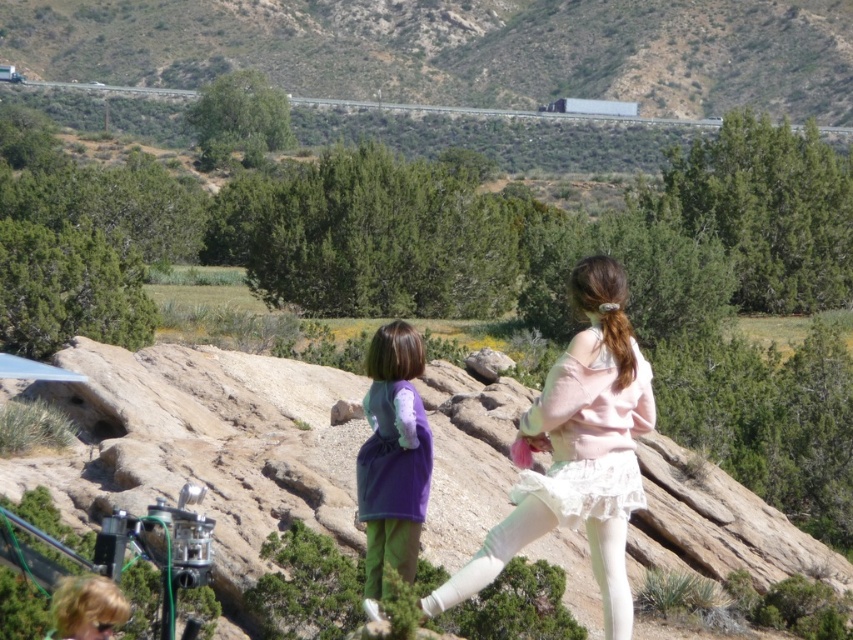
At what (x,y) coordinates should I click in order to perform the action: click on pastel pink fabric skirt at center. Please return your answer as a coordinate pair (x, y). Looking at the image, I should click on (577, 452).

Describe the element at coordinates (577, 452) in the screenshot. Image resolution: width=853 pixels, height=640 pixels. I see `pastel pink fabric skirt at center` at that location.

Image resolution: width=853 pixels, height=640 pixels. Identify the location of pastel pink fabric skirt at center. (577, 452).

Is green grassy hillside at upper center to the left of purple fleece dress at center from the viewer's perspective?

Correct, you'll find green grassy hillside at upper center to the left of purple fleece dress at center.

Does green grassy hillside at upper center appear over purple fleece dress at center?

Yes, green grassy hillside at upper center is above purple fleece dress at center.

What do you see at coordinates (460, 49) in the screenshot? I see `green grassy hillside at upper center` at bounding box center [460, 49].

The image size is (853, 640). In order to click on green grassy hillside at upper center in this screenshot , I will do `click(460, 49)`.

Can you confirm if green grassy hillside at upper center is thinner than pastel pink fabric skirt at center?

No, green grassy hillside at upper center is not thinner than pastel pink fabric skirt at center.

Is green grassy hillside at upper center to the left of pastel pink fabric skirt at center from the viewer's perspective?

Indeed, green grassy hillside at upper center is positioned on the left side of pastel pink fabric skirt at center.

This screenshot has width=853, height=640. What are the coordinates of `green grassy hillside at upper center` in the screenshot? It's located at (460, 49).

The height and width of the screenshot is (640, 853). Identify the location of green grassy hillside at upper center. (460, 49).